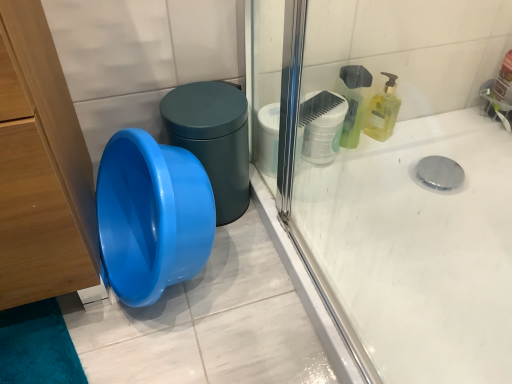
Question: Can you confirm if blue glossy potty at center left is wider than white matte toilet paper at upper right?

Choices:
 (A) yes
 (B) no

Answer: (A)

Question: Is blue glossy potty at center left outside of white matte toilet paper at upper right?

Choices:
 (A) yes
 (B) no

Answer: (A)

Question: Is blue glossy potty at center left positioned far away from white matte toilet paper at upper right?

Choices:
 (A) yes
 (B) no

Answer: (B)

Question: Is blue glossy potty at center left oriented away from white matte toilet paper at upper right?

Choices:
 (A) yes
 (B) no

Answer: (B)

Question: Is blue glossy potty at center left next to white matte toilet paper at upper right and touching it?

Choices:
 (A) yes
 (B) no

Answer: (B)

Question: From their relative heights in the image, would you say silver metallic faucet at upper right is taller or shorter than yellow translucent liquid soap at upper right?

Choices:
 (A) short
 (B) tall

Answer: (A)

Question: Do you think silver metallic faucet at upper right is within yellow translucent liquid soap at upper right, or outside of it?

Choices:
 (A) outside
 (B) inside

Answer: (A)

Question: From a real-world perspective, is silver metallic faucet at upper right positioned above or below yellow translucent liquid soap at upper right?

Choices:
 (A) above
 (B) below

Answer: (B)

Question: Considering the positions of silver metallic faucet at upper right and yellow translucent liquid soap at upper right in the image, is silver metallic faucet at upper right bigger or smaller than yellow translucent liquid soap at upper right?

Choices:
 (A) big
 (B) small

Answer: (A)

Question: Considering the positions of point (162, 124) and point (508, 124), is point (162, 124) closer or farther from the camera than point (508, 124)?

Choices:
 (A) closer
 (B) farther

Answer: (A)

Question: Considering the relative positions of blue glossy potty at center left and silver metallic faucet at upper right in the image provided, is blue glossy potty at center left to the left or to the right of silver metallic faucet at upper right?

Choices:
 (A) right
 (B) left

Answer: (B)

Question: Considering the positions of blue glossy potty at center left and silver metallic faucet at upper right in the image, is blue glossy potty at center left taller or shorter than silver metallic faucet at upper right?

Choices:
 (A) short
 (B) tall

Answer: (B)

Question: In the image, is blue glossy potty at center left positioned in front of or behind silver metallic faucet at upper right?

Choices:
 (A) behind
 (B) front

Answer: (B)

Question: Is white matte toilet paper at upper right taller or shorter than blue glossy potty at center left?

Choices:
 (A) tall
 (B) short

Answer: (B)

Question: Is point (318, 162) positioned closer to the camera than point (175, 99)?

Choices:
 (A) farther
 (B) closer

Answer: (A)